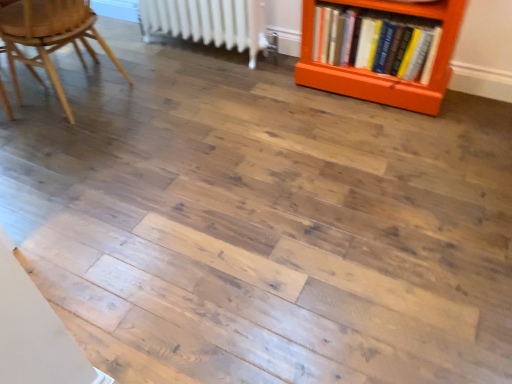
The width and height of the screenshot is (512, 384). I want to click on vacant space underneath wooden chair at left (from a real-world perspective), so click(x=87, y=101).